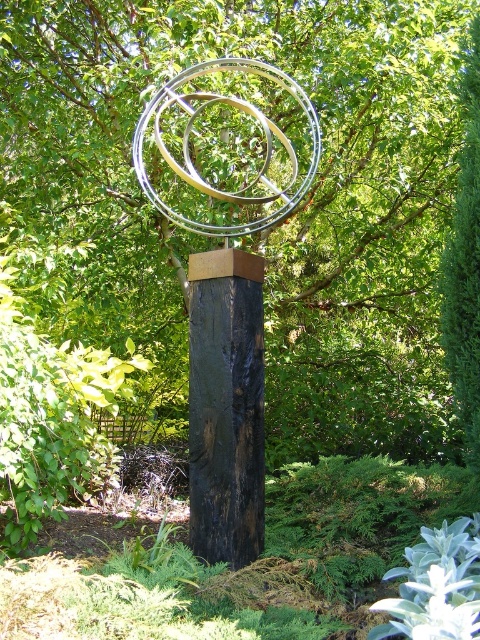
Consider the image. You are an artist planning to photograph the sculpture from a distance. You want to ensure that the metallic rings at center and the black wood post at center are both clearly visible in the frame. Based on their sizes, which object might appear larger in the photo?

The metallic rings at center might appear larger in the photo since they are wider than the black wood post at center according to the description.

You are standing at the base of the tall, dark wooden post with the metallic rings sculpture. You want to place a small bench between the sculpture and the green leafy tree at center. The bench is 2 meters long. Will there be enough space between them to place the bench without it touching either the sculpture or the tree?

The distance between the sculpture and the green leafy tree at center is 3.94 meters. Since the bench is 2 meters long, there will be enough space to place it between them without touching either the sculpture or the tree.

You are an artist planning to install a new sculpture in a garden. You have two options for the central structure of your sculpture. The first option is the metallic rings at center from the image, and the second option is the polished silver rings at center. Based on the description provided, which of these two options would be more suitable if you want a taller central structure for your sculpture?

The metallic rings at center is much taller as polished silver rings at center, so the metallic rings at center would be more suitable for a taller central structure.